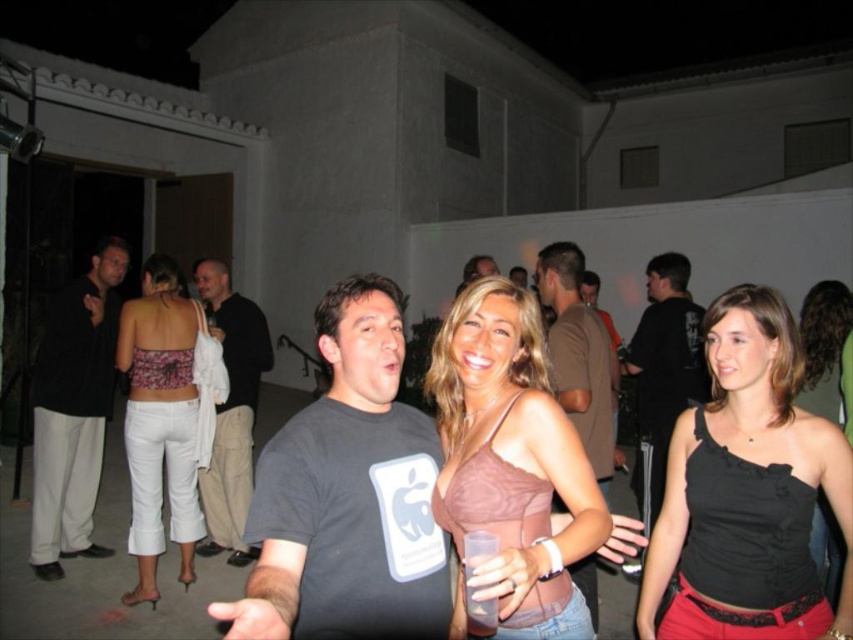
Question: Among these points, which one is nearest to the camera?

Choices:
 (A) (399, 604)
 (B) (170, 349)
 (C) (759, 509)
 (D) (587, 420)

Answer: (A)

Question: Is black satin tank top at center behind black cotton shirt at left?

Choices:
 (A) yes
 (B) no

Answer: (B)

Question: Does black satin tank top at center have a greater width compared to pink satin tank top at center?

Choices:
 (A) yes
 (B) no

Answer: (A)

Question: Among these objects, which one is nearest to the camera?

Choices:
 (A) black matte shirt at center
 (B) brown cotton t-shirt at center
 (C) black cotton shirt at left

Answer: (B)

Question: Based on their relative distances, which object is nearer to the black cotton shirt at left?

Choices:
 (A) floral fabric top at left
 (B) dark gray t-shirt at center

Answer: (A)

Question: Does floral fabric top at left have a lesser width compared to black matte shirt at center?

Choices:
 (A) yes
 (B) no

Answer: (B)